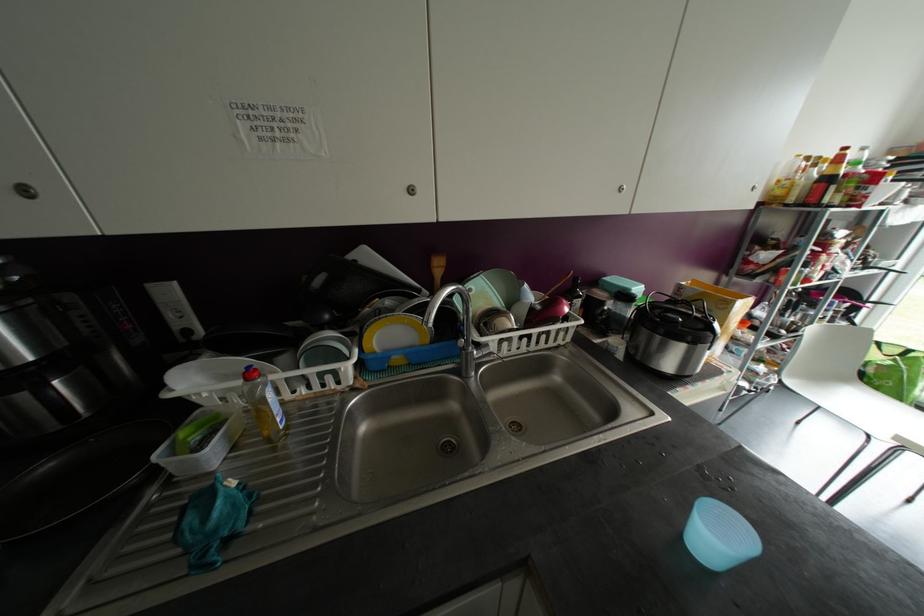
Which object does [263,405] point to?

It refers to a yellow dish soap bottle.